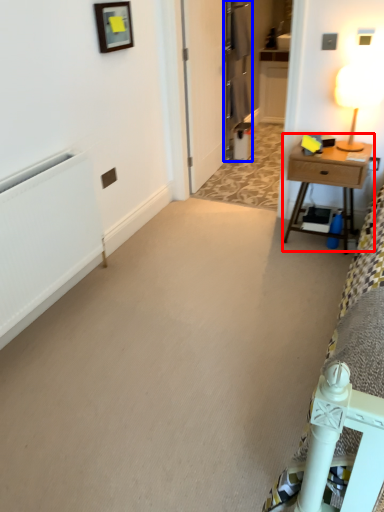
Question: Which object is further to the camera taking this photo, nightstand (highlighted by a red box) or armoire (highlighted by a blue box)?

Choices:
 (A) nightstand
 (B) armoire

Answer: (B)